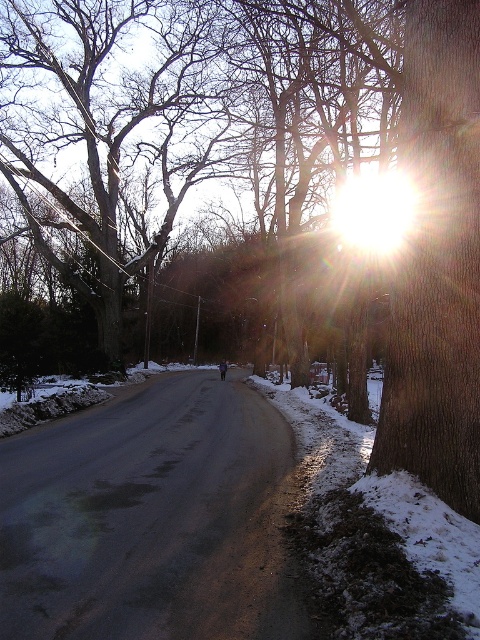
You are standing at the center of the road in the winter scene. Which direction should you walk to reach the smooth bark tree at left?

The smooth bark tree at left is located at coordinates 0.200 on the x axis and 0.219 on the y axis, so you should walk towards the left side of the image to reach it.

You are a hiker trying to identify landmarks along a snowy path. You notice a point marked at coordinates (105, 128) on your map. Which landmark does this point correspond to?

The point at (105, 128) corresponds to the smooth bark tree at left.